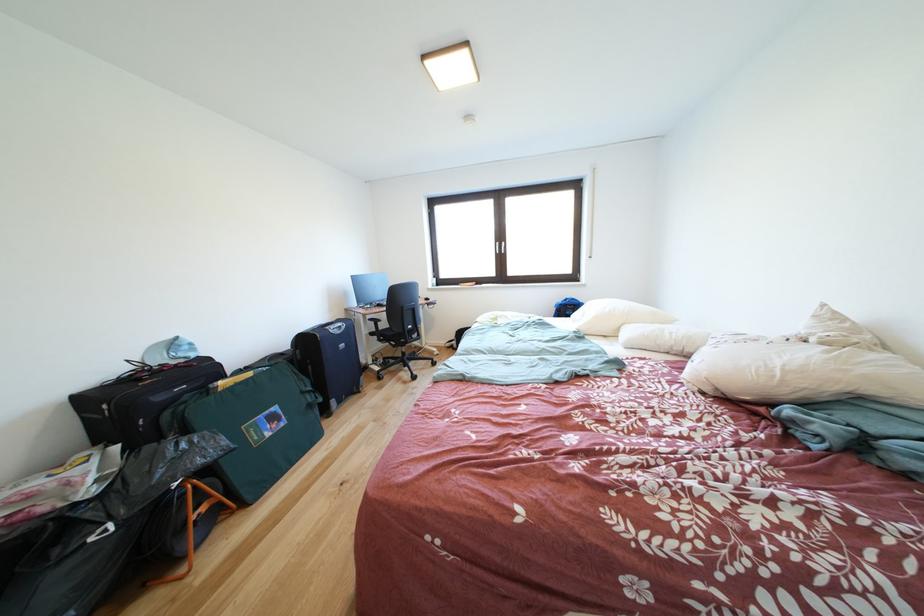
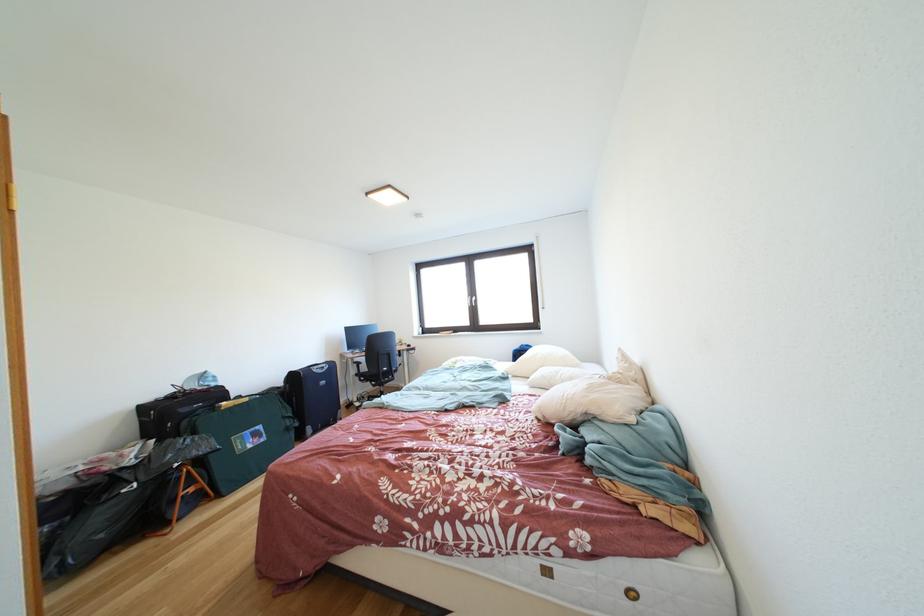
Locate, in the second image, the point that corresponds to pixel 330 405 in the first image.

(306, 429)